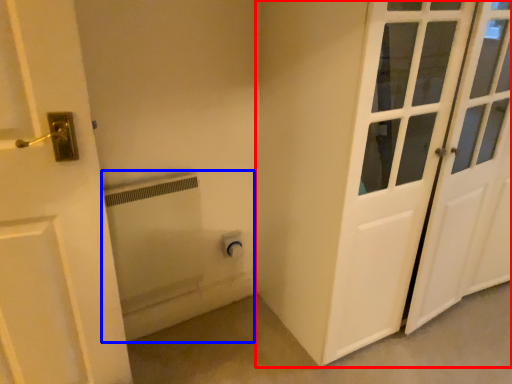
Question: Which object is closer to the camera taking this photo, door (highlighted by a red box) or bath (highlighted by a blue box)?

Choices:
 (A) door
 (B) bath

Answer: (A)